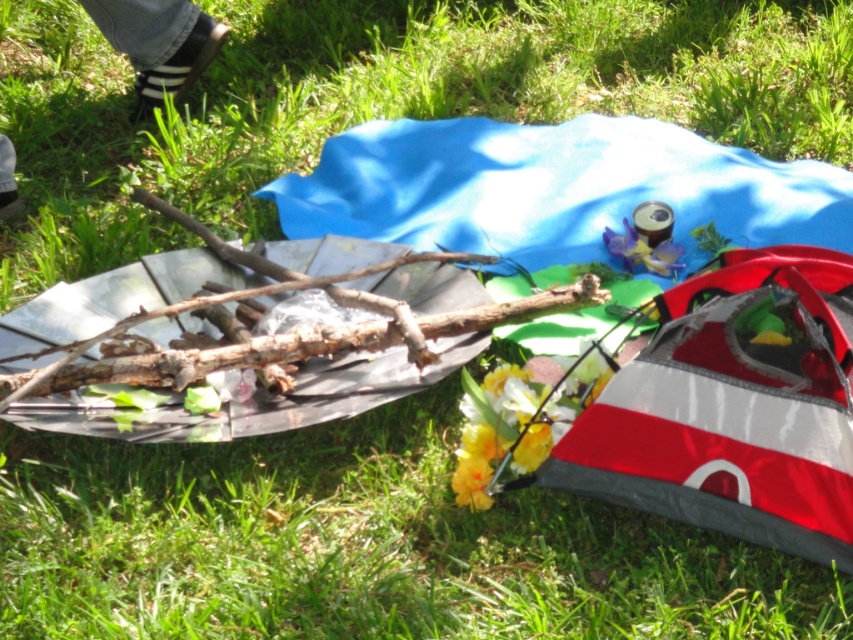
Question: Which of the following is the farthest from the observer?

Choices:
 (A) (10, 180)
 (B) (627, 227)

Answer: (A)

Question: Which point is closer to the camera taking this photo?

Choices:
 (A) (154, 83)
 (B) (581, 403)

Answer: (B)

Question: Can you confirm if black leather shoe at upper left is bigger than yellow matte flower at center?

Choices:
 (A) no
 (B) yes

Answer: (B)

Question: Which object appears farthest from the camera in this image?

Choices:
 (A) yellow matte flower at center
 (B) yellow artificial flower at center

Answer: (A)

Question: Does yellow artificial flower at center come in front of black leather shoe at upper left?

Choices:
 (A) no
 (B) yes

Answer: (B)

Question: Can you confirm if yellow artificial flower at center is positioned to the left of black leather shoe at upper left?

Choices:
 (A) no
 (B) yes

Answer: (A)